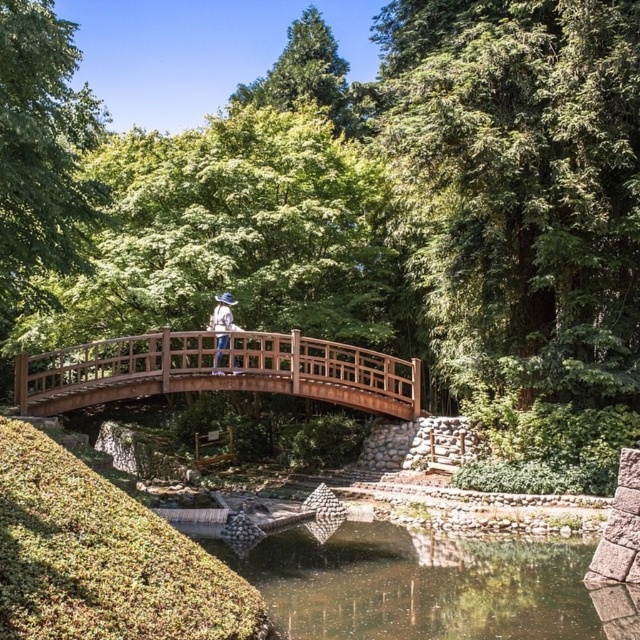
Question: Is clear water at center positioned behind white fabric hat at center?

Choices:
 (A) yes
 (B) no

Answer: (B)

Question: Which point is farther from the camera taking this photo?

Choices:
 (A) (486, 620)
 (B) (216, 579)
 (C) (225, 337)
 (D) (288, 349)

Answer: (D)

Question: Does clear water at center have a greater width compared to green mossy rock at lower left?

Choices:
 (A) no
 (B) yes

Answer: (B)

Question: Is clear water at center below green mossy rock at lower left?

Choices:
 (A) yes
 (B) no

Answer: (A)

Question: Which object appears farthest from the camera in this image?

Choices:
 (A) clear water at center
 (B) wooden bridge at center
 (C) white fabric hat at center

Answer: (C)

Question: Which object is the closest to the green mossy rock at lower left?

Choices:
 (A) clear water at center
 (B) wooden bridge at center

Answer: (A)